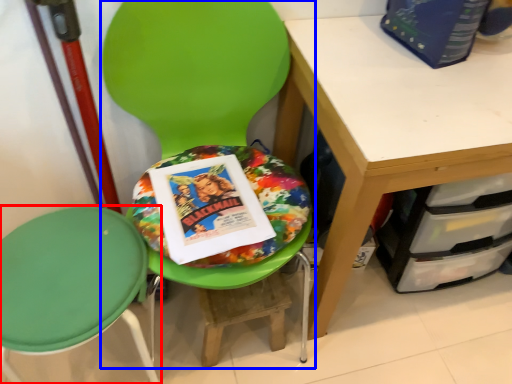
Question: Which object appears farthest to the camera in this image, chair (highlighted by a red box) or chair (highlighted by a blue box)?

Choices:
 (A) chair
 (B) chair

Answer: (A)